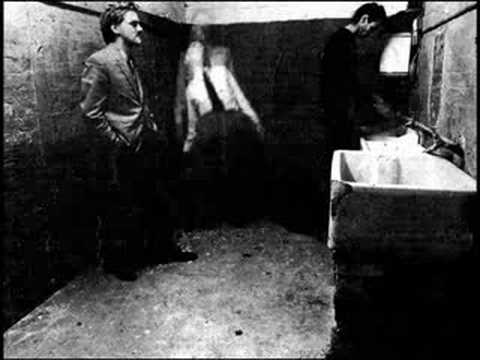
Locate an element on the screen. This screenshot has height=360, width=480. floor is located at coordinates (282, 289).